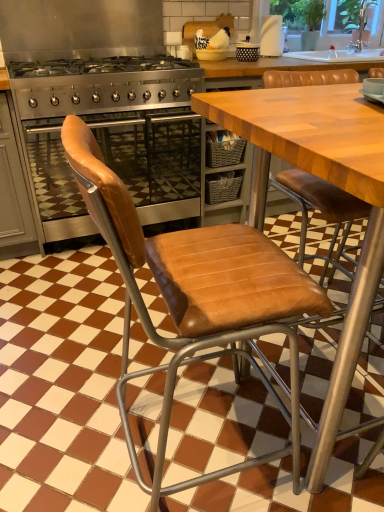
I want to click on free location in front of satin silver oven at left, so click(x=35, y=278).